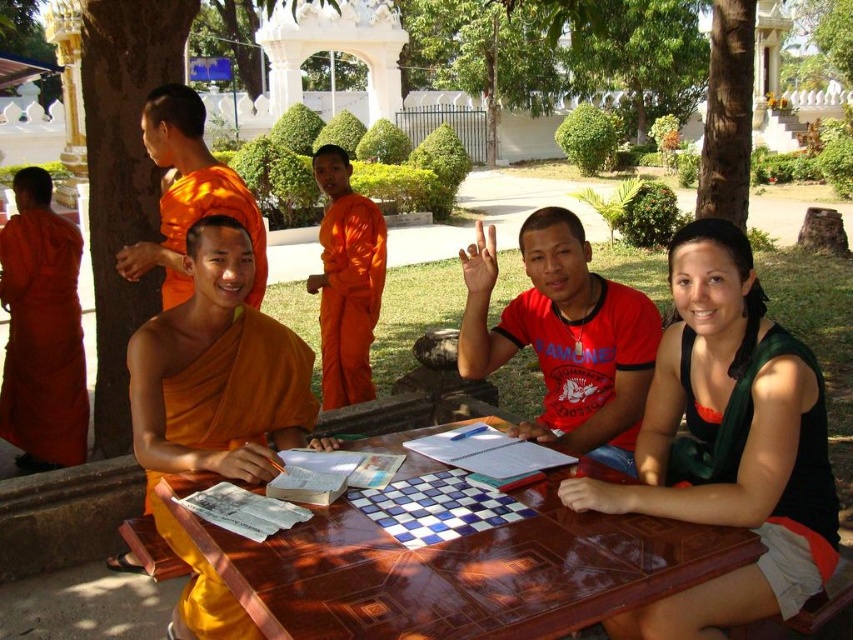
You are standing in the temple garden and see the red matte shirt at center. Can you estimate its position using a coordinate system where the bottom left corner is the origin?

The red matte shirt at center is located at coordinates approximately 0.528 on the x axis and 0.662 on the y axis.

You are standing in front of the wooden table in the temple garden scene. There are two points marked on the table surface, one at coordinate point (312, 572) and another at point (786, 522). If you want to place a small object on the table closer to you, which point should you choose?

You should choose point (312, 572) because it is closer to the viewer than point (786, 522).

You are organizing a small gathering at this temple garden and need to ensure there is enough space for everyone. Given that the red matte shirt at center and the orange cloth at left are both on the table, which object takes up more space horizontally?

The orange cloth at left takes up more space horizontally because its width is greater than the red matte shirt at center.